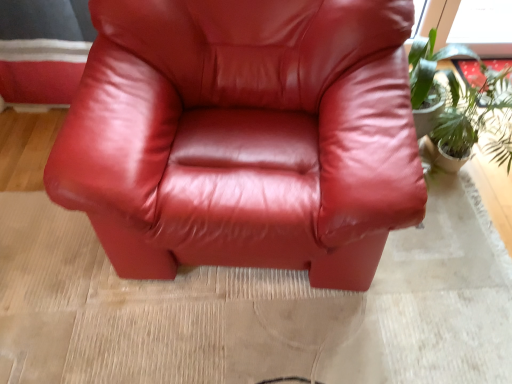
The height and width of the screenshot is (384, 512). I want to click on glossy leather chair at center, so click(243, 136).

Describe the element at coordinates (243, 136) in the screenshot. I see `glossy leather chair at center` at that location.

The height and width of the screenshot is (384, 512). Describe the element at coordinates (464, 102) in the screenshot. I see `green leafy plant at right` at that location.

You are a GUI agent. You are given a task and a screenshot of the screen. Output one action in this format:
    pyautogui.click(x=<x>, y=<y>)
    Task: Click on the green leafy plant at right
    The width and height of the screenshot is (512, 384).
    Given the screenshot: What is the action you would take?
    pyautogui.click(x=464, y=102)

Where is `glossy leather chair at center`? glossy leather chair at center is located at coordinates (243, 136).

Would you say glossy leather chair at center is to the left or to the right of green leafy plant at right in the picture?

Clearly, glossy leather chair at center is on the left of green leafy plant at right in the image.

Based on the photo, considering the relative positions of glossy leather chair at center and green leafy plant at right in the image provided, is glossy leather chair at center in front of green leafy plant at right?

Yes, it is in front of green leafy plant at right.

Between point (362, 62) and point (465, 154), which one is positioned in front?

The point (362, 62) is more forward.

From the image's perspective, is glossy leather chair at center below green leafy plant at right?

Yes, from the image's perspective, glossy leather chair at center is below green leafy plant at right.

From a real-world perspective, which object rests below the other?

In real-world perspective, green leafy plant at right is lower.

Between glossy leather chair at center and green leafy plant at right, which one has larger width?

Wider between the two is glossy leather chair at center.

Between glossy leather chair at center and green leafy plant at right, which one has less height?

Standing shorter between the two is green leafy plant at right.

Considering the relative sizes of glossy leather chair at center and green leafy plant at right in the image provided, is glossy leather chair at center smaller than green leafy plant at right?

Actually, glossy leather chair at center might be larger than green leafy plant at right.

Would you say glossy leather chair at center is inside or outside green leafy plant at right?

glossy leather chair at center is not inside green leafy plant at right, it's outside.

Is there a large distance between glossy leather chair at center and green leafy plant at right?

glossy leather chair at center is actually quite close to green leafy plant at right.

Is green leafy plant at right at the back of glossy leather chair at center?

No, green leafy plant at right is not at the back of glossy leather chair at center.

How far apart are glossy leather chair at center and green leafy plant at right?

A distance of 25.02 inches exists between glossy leather chair at center and green leafy plant at right.

This screenshot has height=384, width=512. I want to click on houseplant below the glossy leather chair at center (from a real-world perspective), so click(464, 102).

Between green leafy plant at right and glossy leather chair at center, which one appears on the left side from the viewer's perspective?

Positioned to the left is glossy leather chair at center.

Is green leafy plant at right behind glossy leather chair at center?

Yes, the depth of green leafy plant at right is greater than that of glossy leather chair at center.

Is point (431, 80) farther from camera compared to point (325, 108)?

Yes, point (431, 80) is farther from viewer.

From the image's perspective, who appears lower, green leafy plant at right or glossy leather chair at center?

glossy leather chair at center is shown below in the image.

From the picture: From a real-world perspective, is green leafy plant at right positioned over glossy leather chair at center based on gravity?

Actually, green leafy plant at right is physically below glossy leather chair at center in the real world.

From the picture: Considering the sizes of green leafy plant at right and glossy leather chair at center in the image, is green leafy plant at right wider or thinner than glossy leather chair at center?

Considering their sizes, green leafy plant at right looks slimmer than glossy leather chair at center.

Is green leafy plant at right taller or shorter than glossy leather chair at center?

Considering their sizes, green leafy plant at right has less height than glossy leather chair at center.

Between green leafy plant at right and glossy leather chair at center, which one has larger size?

With larger size is glossy leather chair at center.

Does green leafy plant at right contain glossy leather chair at center?

Actually, glossy leather chair at center is outside green leafy plant at right.

Is green leafy plant at right positioned far away from glossy leather chair at center?

green leafy plant at right is actually quite close to glossy leather chair at center.

Is green leafy plant at right oriented towards glossy leather chair at center?

No, green leafy plant at right does not turn towards glossy leather chair at center.

What's the angular difference between green leafy plant at right and glossy leather chair at center's facing directions?

The angle between the facing direction of green leafy plant at right and the facing direction of glossy leather chair at center is 1.47 degrees.

Where is `chair above the green leafy plant at right (from a real-world perspective)`? The width and height of the screenshot is (512, 384). chair above the green leafy plant at right (from a real-world perspective) is located at coordinates (243, 136).

In order to click on houseplant below the glossy leather chair at center (from a real-world perspective) in this screenshot , I will do `click(464, 102)`.

Locate an element on the screen. houseplant on the right of glossy leather chair at center is located at coordinates (464, 102).